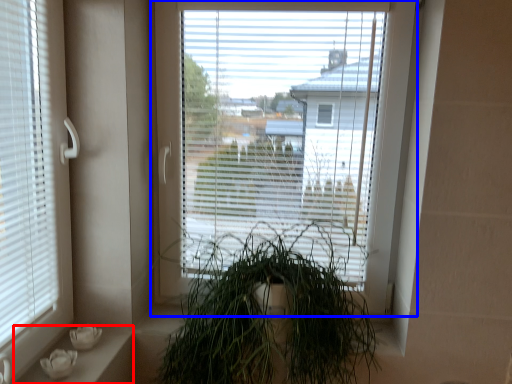
Question: Which point is further to the camera, window sill (highlighted by a red box) or window (highlighted by a blue box)?

Choices:
 (A) window sill
 (B) window

Answer: (B)